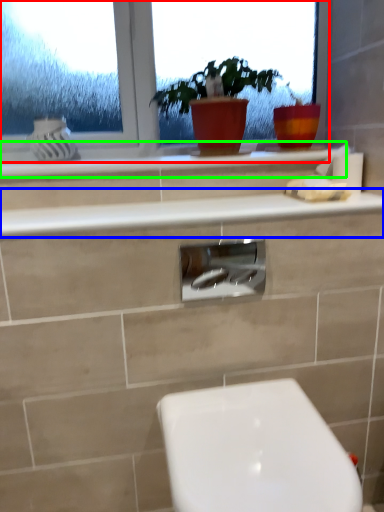
Question: Considering the real-world distances, which object is closest to window (highlighted by a red box)? counter top (highlighted by a blue box) or counter top (highlighted by a green box).

Choices:
 (A) counter top
 (B) counter top

Answer: (B)